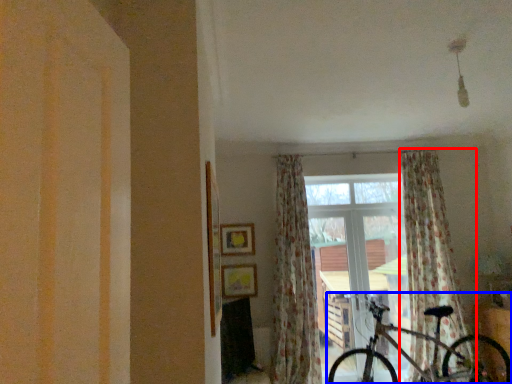
Question: Among these objects, which one is farthest to the camera, curtain (highlighted by a red box) or bicycle (highlighted by a blue box)?

Choices:
 (A) curtain
 (B) bicycle

Answer: (A)